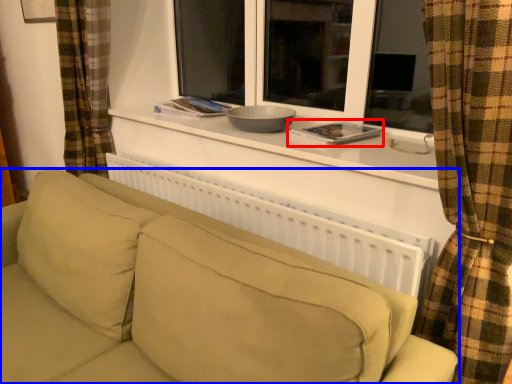
Question: Which object appears farthest to the camera in this image, book (highlighted by a red box) or studio couch (highlighted by a blue box)?

Choices:
 (A) book
 (B) studio couch

Answer: (A)